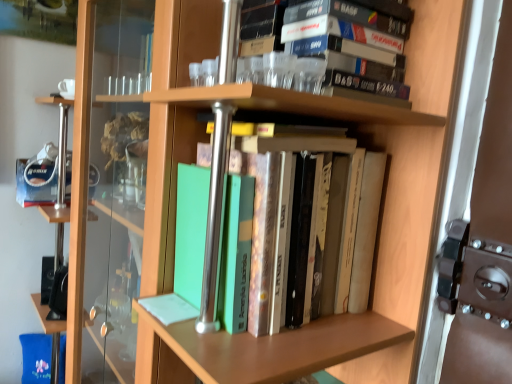
What do you see at coordinates (350, 46) in the screenshot? I see `matte black cassette tape at upper center, arranged as the second book when ordered from the bottom` at bounding box center [350, 46].

Where is `matte black cassette tape at upper center, arranged as the second book when ordered from the bottom`? matte black cassette tape at upper center, arranged as the second book when ordered from the bottom is located at coordinates (350, 46).

The width and height of the screenshot is (512, 384). In order to click on green matte book at center, positioned as the 2th book in top-to-bottom order in this screenshot , I will do pyautogui.click(x=287, y=228).

This screenshot has width=512, height=384. What do you see at coordinates (287, 228) in the screenshot?
I see `green matte book at center, positioned as the 2th book in top-to-bottom order` at bounding box center [287, 228].

What is the approximate width of green matte book at center, which is the first book in bottom-to-top order?

13.35 inches.

Where is `matte black cassette tape at upper center, arranged as the second book when ordered from the bottom`? matte black cassette tape at upper center, arranged as the second book when ordered from the bottom is located at coordinates (350, 46).

Based on their positions, is green matte book at center, which is the first book in bottom-to-top order, located to the left or right of matte black cassette tape at upper center, the 1th book positioned from the top?

Clearly, green matte book at center, which is the first book in bottom-to-top order, is on the left of matte black cassette tape at upper center, the 1th book positioned from the top, in the image.

In the image, is green matte book at center, positioned as the 2th book in top-to-bottom order, positioned in front of or behind matte black cassette tape at upper center, arranged as the second book when ordered from the bottom?

green matte book at center, positioned as the 2th book in top-to-bottom order, is positioned closer to the viewer than matte black cassette tape at upper center, arranged as the second book when ordered from the bottom.

Does point (328, 128) lie in front of point (380, 19)?

No, (328, 128) is behind (380, 19).

From the image's perspective, would you say green matte book at center, which is the first book in bottom-to-top order, is positioned over matte black cassette tape at upper center, the 1th book positioned from the top?

No.

From a real-world perspective, is green matte book at center, positioned as the 2th book in top-to-bottom order, physically above matte black cassette tape at upper center, the 1th book positioned from the top?

No.

Which object is wider, green matte book at center, which is the first book in bottom-to-top order, or matte black cassette tape at upper center, arranged as the second book when ordered from the bottom?

With larger width is green matte book at center, which is the first book in bottom-to-top order.

Consider the image. Is green matte book at center, positioned as the 2th book in top-to-bottom order, taller than matte black cassette tape at upper center, the 1th book positioned from the top?

Indeed, green matte book at center, positioned as the 2th book in top-to-bottom order, has a greater height compared to matte black cassette tape at upper center, the 1th book positioned from the top.

Between green matte book at center, which is the first book in bottom-to-top order, and matte black cassette tape at upper center, arranged as the second book when ordered from the bottom, which one has larger size?

green matte book at center, which is the first book in bottom-to-top order, is bigger.

Is green matte book at center, positioned as the 2th book in top-to-bottom order, positioned beyond the bounds of matte black cassette tape at upper center, arranged as the second book when ordered from the bottom?

green matte book at center, positioned as the 2th book in top-to-bottom order, lies outside matte black cassette tape at upper center, arranged as the second book when ordered from the bottom,'s area.

Is green matte book at center, positioned as the 2th book in top-to-bottom order, next to matte black cassette tape at upper center, the 1th book positioned from the top?

No, green matte book at center, positioned as the 2th book in top-to-bottom order, is not touching matte black cassette tape at upper center, the 1th book positioned from the top.

Is green matte book at center, which is the first book in bottom-to-top order, facing towards matte black cassette tape at upper center, the 1th book positioned from the top?

No.

In the scene shown: How different are the orientations of green matte book at center, which is the first book in bottom-to-top order, and matte black cassette tape at upper center, the 1th book positioned from the top, in degrees?

0.868 degrees separate the facing orientations of green matte book at center, which is the first book in bottom-to-top order, and matte black cassette tape at upper center, the 1th book positioned from the top.

Measure the distance from green matte book at center, which is the first book in bottom-to-top order, to matte black cassette tape at upper center, the 1th book positioned from the top.

green matte book at center, which is the first book in bottom-to-top order, and matte black cassette tape at upper center, the 1th book positioned from the top, are 8.63 inches apart from each other.

You are a GUI agent. You are given a task and a screenshot of the screen. Output one action in this format:
    pyautogui.click(x=<x>, y=<y>)
    Task: Click on the book that appears on the right of green matte book at center, positioned as the 2th book in top-to-bottom order
    
    Given the screenshot: What is the action you would take?
    pyautogui.click(x=350, y=46)

Which object is positioned more to the right, matte black cassette tape at upper center, arranged as the second book when ordered from the bottom, or green matte book at center, positioned as the 2th book in top-to-bottom order?

Positioned to the right is matte black cassette tape at upper center, arranged as the second book when ordered from the bottom.

Considering the positions of objects matte black cassette tape at upper center, arranged as the second book when ordered from the bottom, and green matte book at center, positioned as the 2th book in top-to-bottom order, in the image provided, who is behind, matte black cassette tape at upper center, arranged as the second book when ordered from the bottom, or green matte book at center, positioned as the 2th book in top-to-bottom order,?

matte black cassette tape at upper center, arranged as the second book when ordered from the bottom, is further away from the camera.

Does point (365, 30) appear closer or farther from the camera than point (290, 158)?

Point (365, 30).

From the image's perspective, is matte black cassette tape at upper center, arranged as the second book when ordered from the bottom, positioned above or below green matte book at center, positioned as the 2th book in top-to-bottom order?

From the image's perspective, matte black cassette tape at upper center, arranged as the second book when ordered from the bottom, appears above green matte book at center, positioned as the 2th book in top-to-bottom order.

From a real-world perspective, is matte black cassette tape at upper center, arranged as the second book when ordered from the bottom, positioned under green matte book at center, positioned as the 2th book in top-to-bottom order, based on gravity?

No, from a real-world perspective, matte black cassette tape at upper center, arranged as the second book when ordered from the bottom, is not under green matte book at center, positioned as the 2th book in top-to-bottom order.

In terms of width, does matte black cassette tape at upper center, arranged as the second book when ordered from the bottom, look wider or thinner when compared to green matte book at center, which is the first book in bottom-to-top order?

Considering their sizes, matte black cassette tape at upper center, arranged as the second book when ordered from the bottom, looks slimmer than green matte book at center, which is the first book in bottom-to-top order.

Is matte black cassette tape at upper center, the 1th book positioned from the top, shorter than green matte book at center, which is the first book in bottom-to-top order?

Yes.

Which of these two, matte black cassette tape at upper center, the 1th book positioned from the top, or green matte book at center, which is the first book in bottom-to-top order, is bigger?

green matte book at center, which is the first book in bottom-to-top order.

Is matte black cassette tape at upper center, arranged as the second book when ordered from the bottom, inside or outside of green matte book at center, which is the first book in bottom-to-top order?

matte black cassette tape at upper center, arranged as the second book when ordered from the bottom, lies outside green matte book at center, which is the first book in bottom-to-top order.

Is matte black cassette tape at upper center, the 1th book positioned from the top, not near green matte book at center, positioned as the 2th book in top-to-bottom order?

No, matte black cassette tape at upper center, the 1th book positioned from the top, is not far from green matte book at center, positioned as the 2th book in top-to-bottom order.

Could you tell me if matte black cassette tape at upper center, arranged as the second book when ordered from the bottom, is facing green matte book at center, which is the first book in bottom-to-top order?

No, matte black cassette tape at upper center, arranged as the second book when ordered from the bottom, is not aimed at green matte book at center, which is the first book in bottom-to-top order.

Identify the location of book below the matte black cassette tape at upper center, the 1th book positioned from the top (from a real-world perspective). (287, 228).

Identify the location of book below the matte black cassette tape at upper center, the 1th book positioned from the top (from a real-world perspective). (287, 228).

At what (x,y) coordinates should I click in order to perform the action: click on book on the left of matte black cassette tape at upper center, arranged as the second book when ordered from the bottom. Please return your answer as a coordinate pair (x, y). This screenshot has height=384, width=512. Looking at the image, I should click on (287, 228).